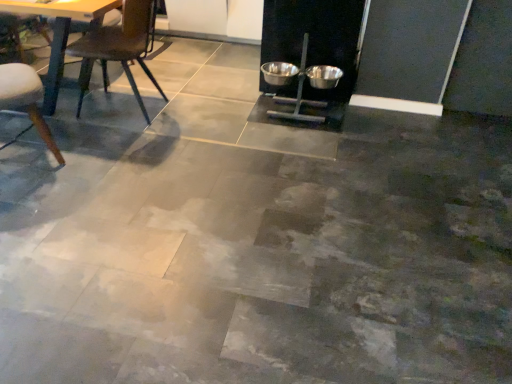
Question: Is wooden chair at left, the second chair when ordered from right to left, taller than metallic dark brown chair at left, the first chair positioned from the right?

Choices:
 (A) yes
 (B) no

Answer: (B)

Question: Is wooden chair at left, the second chair when ordered from right to left, outside of metallic dark brown chair at left, positioned as the 2th chair in left-to-right order?

Choices:
 (A) yes
 (B) no

Answer: (A)

Question: From a real-world perspective, is wooden chair at left, the first chair positioned from the left, under metallic dark brown chair at left, positioned as the 2th chair in left-to-right order?

Choices:
 (A) yes
 (B) no

Answer: (A)

Question: Can you confirm if wooden chair at left, the first chair positioned from the left, is smaller than metallic dark brown chair at left, the first chair positioned from the right?

Choices:
 (A) yes
 (B) no

Answer: (A)

Question: Is wooden chair at left, the second chair when ordered from right to left, surrounding metallic dark brown chair at left, positioned as the 2th chair in left-to-right order?

Choices:
 (A) yes
 (B) no

Answer: (B)

Question: Considering the positions of wooden chair at left, the second chair when ordered from right to left, and metallic silver bowl at center-right, the 1th bowl from the right, in the image, is wooden chair at left, the second chair when ordered from right to left, wider or thinner than metallic silver bowl at center-right, the 1th bowl from the right,?

Choices:
 (A) wide
 (B) thin

Answer: (A)

Question: Considering the positions of wooden chair at left, the second chair when ordered from right to left, and metallic silver bowl at center-right, the 2th bowl viewed from the left, in the image, is wooden chair at left, the second chair when ordered from right to left, bigger or smaller than metallic silver bowl at center-right, the 2th bowl viewed from the left,?

Choices:
 (A) small
 (B) big

Answer: (B)

Question: From a real-world perspective, is wooden chair at left, the first chair positioned from the left, above or below metallic silver bowl at center-right, the 1th bowl from the right?

Choices:
 (A) above
 (B) below

Answer: (A)

Question: From their relative heights in the image, would you say wooden chair at left, the second chair when ordered from right to left, is taller or shorter than metallic silver bowl at center-right, the 2th bowl viewed from the left?

Choices:
 (A) tall
 (B) short

Answer: (A)

Question: Looking at their shapes, would you say metallic dark brown chair at left, the first chair positioned from the right, is wider or thinner than metallic bowls at center, placed as the first bowl when sorted from left to right?

Choices:
 (A) thin
 (B) wide

Answer: (B)

Question: Is metallic dark brown chair at left, positioned as the 2th chair in left-to-right order, spatially inside metallic bowls at center, placed as the first bowl when sorted from left to right, or outside of it?

Choices:
 (A) inside
 (B) outside

Answer: (B)

Question: From the image's perspective, is metallic dark brown chair at left, positioned as the 2th chair in left-to-right order, located above or below metallic bowls at center, the second bowl in the right-to-left sequence?

Choices:
 (A) below
 (B) above

Answer: (B)

Question: Is point (88, 77) closer or farther from the camera than point (275, 66)?

Choices:
 (A) closer
 (B) farther

Answer: (A)

Question: From the image's perspective, is metallic bowls at center, placed as the first bowl when sorted from left to right, above or below wooden chair at left, the first chair positioned from the left?

Choices:
 (A) below
 (B) above

Answer: (B)

Question: Looking at their shapes, would you say metallic bowls at center, the second bowl in the right-to-left sequence, is wider or thinner than wooden chair at left, the second chair when ordered from right to left?

Choices:
 (A) wide
 (B) thin

Answer: (B)